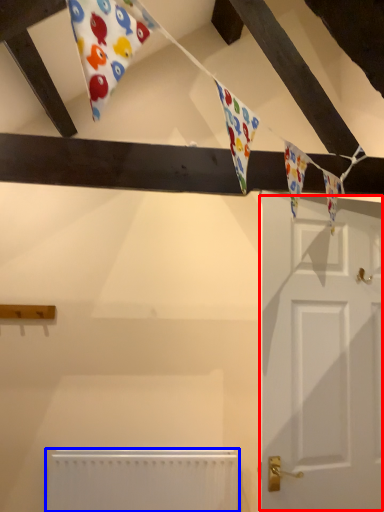
Question: Among these objects, which one is farthest to the camera, door (highlighted by a red box) or radiator (highlighted by a blue box)?

Choices:
 (A) door
 (B) radiator

Answer: (B)